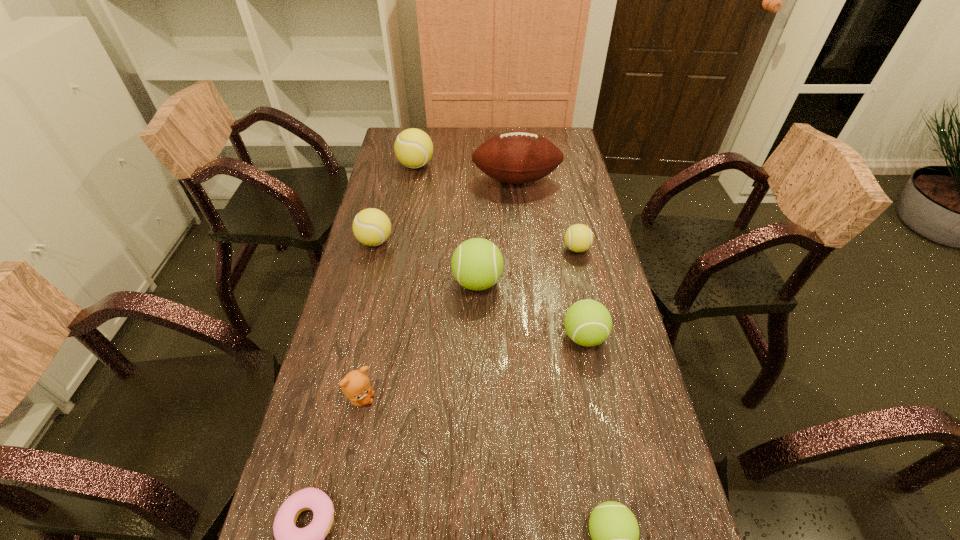
Locate an element on the screen. brown teddy bear is located at coordinates (355, 385).

Find the location of `the rightmost yellow tennis ball`. the rightmost yellow tennis ball is located at coordinates (578, 238).

At what (x,y) coordinates should I click in order to perform the action: click on free space located on the front of the tallest object. Please return your answer as a coordinate pair (x, y). Looking at the image, I should click on (523, 256).

The image size is (960, 540). I want to click on vacant area located on the right of the farthest tennis ball, so click(475, 165).

Image resolution: width=960 pixels, height=540 pixels. Identify the location of vacant space located on the back of the farthest green tennis ball. (478, 220).

This screenshot has width=960, height=540. I want to click on vacant point located 0.310m on the front of the second smallest yellow tennis ball, so click(x=352, y=333).

You are a GUI agent. You are given a task and a screenshot of the screen. Output one action in this format:
    pyautogui.click(x=<x>, y=<y>)
    Task: Click on the vacant space located on the left of the fourth nearest object
    This screenshot has height=540, width=960.
    Given the screenshot: What is the action you would take?
    pyautogui.click(x=434, y=337)

The height and width of the screenshot is (540, 960). I want to click on vacant space situated on the face of the seventh farthest object, so click(x=443, y=400).

Locate an element on the screen. vacant area situated on the front of the rightmost yellow tennis ball is located at coordinates (593, 324).

Identify the location of object that is at the far edge. The height and width of the screenshot is (540, 960). (413, 147).